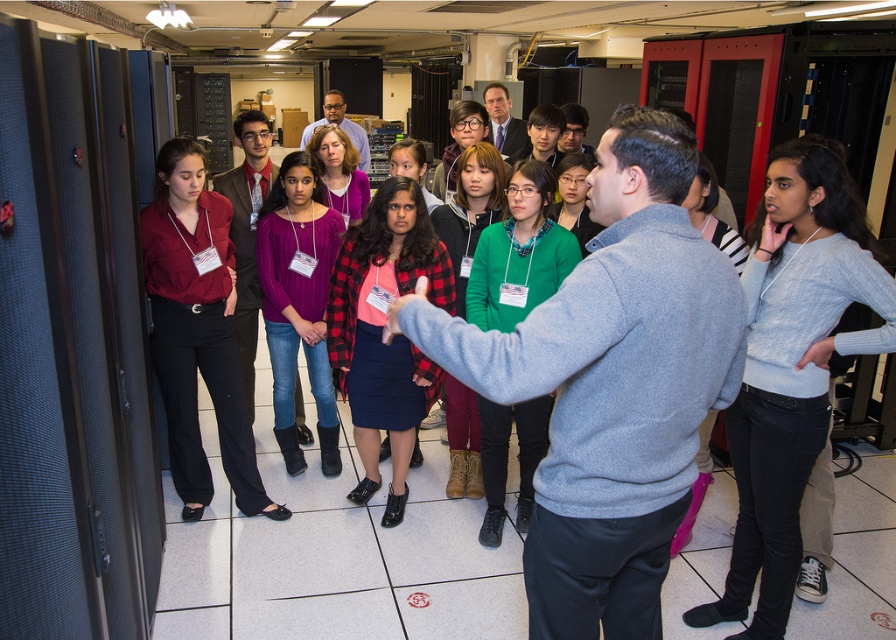
Question: Which object appears farthest from the camera in this image?

Choices:
 (A) matte black pants at center
 (B) light gray sweater at center

Answer: (A)

Question: Does plaid fabric shirt at center lie in front of matte purple sweater at center?

Choices:
 (A) no
 (B) yes

Answer: (B)

Question: Can you confirm if light gray sweater at center is positioned to the right of matte black pants at center?

Choices:
 (A) no
 (B) yes

Answer: (B)

Question: Which is nearer to the light gray sweater at center?

Choices:
 (A) matte purple sweater at center
 (B) plaid fabric shirt at center

Answer: (B)

Question: Considering the relative positions of matte black pants at center and matte purple sweater at center in the image provided, where is matte black pants at center located with respect to matte purple sweater at center?

Choices:
 (A) right
 (B) left

Answer: (B)

Question: Considering the real-world distances, which object is farthest from the plaid fabric shirt at center?

Choices:
 (A) matte purple sweater at center
 (B) light gray sweater at center

Answer: (B)